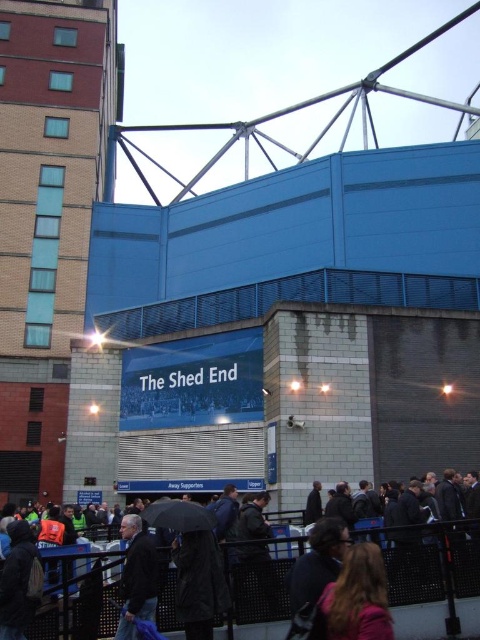
What do you see at coordinates (136, 577) in the screenshot?
I see `dark blue jacket at lower left` at bounding box center [136, 577].

Based on the photo, which is above, dark blue jacket at lower left or black matte umbrella at lower center?

Positioned higher is dark blue jacket at lower left.

Does point (154, 596) come behind point (158, 513)?

No, (154, 596) is in front of (158, 513).

Where is `dark blue jacket at lower left`? dark blue jacket at lower left is located at coordinates (136, 577).

Which is in front, point (331, 602) or point (158, 509)?

Positioned in front is point (331, 602).

Who is positioned more to the right, blonde hair at lower center or black matte umbrella at lower center?

Positioned to the right is blonde hair at lower center.

Does point (375, 636) lie in front of point (160, 508)?

Yes, point (375, 636) is closer to viewer.

Image resolution: width=480 pixels, height=640 pixels. I want to click on blonde hair at lower center, so click(358, 596).

Between dark gray jacket at lower center and dark blue jacket at lower left, which one is positioned lower?

dark gray jacket at lower center

Who is positioned more to the left, dark gray jacket at lower center or dark blue jacket at lower left?

Positioned to the left is dark blue jacket at lower left.

Between point (453, 532) and point (129, 561), which one is positioned behind?

Positioned behind is point (453, 532).

The height and width of the screenshot is (640, 480). Find the location of `dark gray jacket at lower center`. dark gray jacket at lower center is located at coordinates (432, 564).